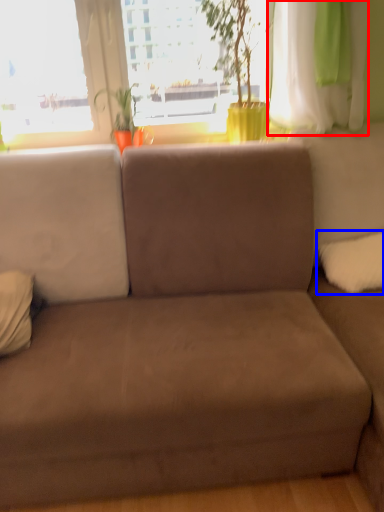
Question: Which of the following is the farthest to the observer, curtain (highlighted by a red box) or pillow (highlighted by a blue box)?

Choices:
 (A) curtain
 (B) pillow

Answer: (B)